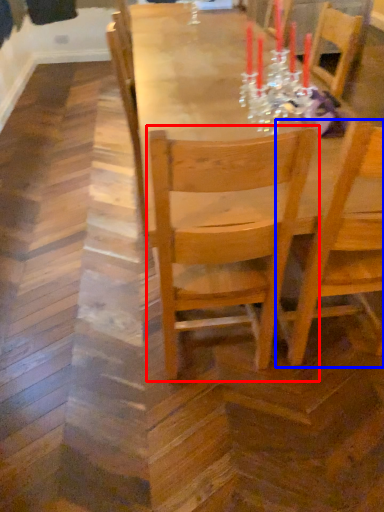
Question: Which object is further to the camera taking this photo, chair (highlighted by a red box) or chair (highlighted by a blue box)?

Choices:
 (A) chair
 (B) chair

Answer: (B)